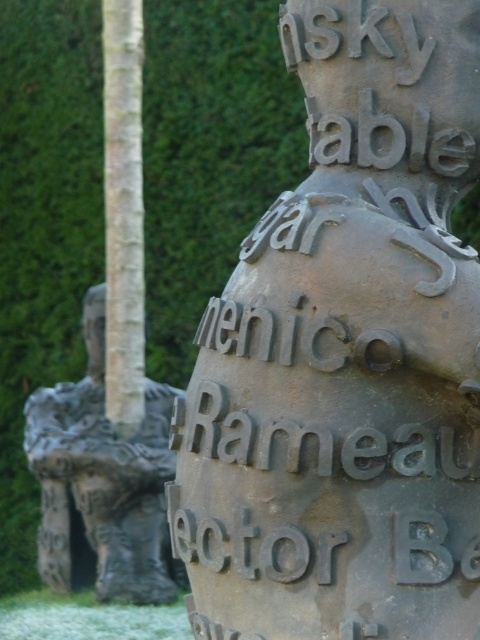
Is rusty metal sculpture at center thinner than rough stone elephant at left?

No.

Between rusty metal sculpture at center and rough stone elephant at left, which one is positioned higher?

Positioned higher is rusty metal sculpture at center.

Is point (299, 368) farther from camera compared to point (97, 426)?

No, (299, 368) is closer to viewer.

Locate an element on the screen. The height and width of the screenshot is (640, 480). rusty metal sculpture at center is located at coordinates (346, 355).